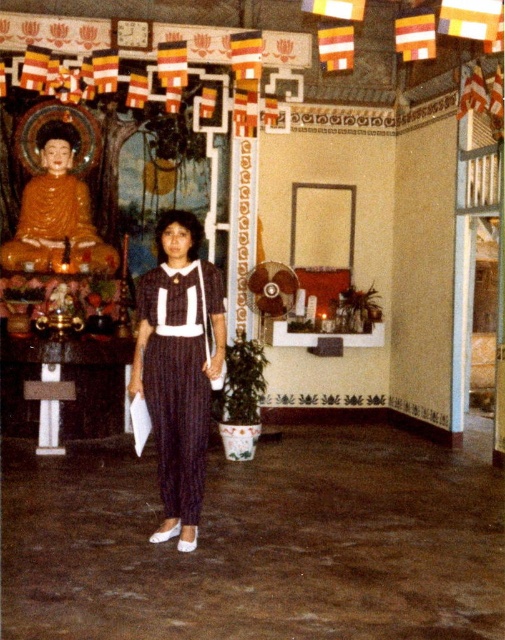
You are a photographer trying to capture a balanced composition. You have to position the striped fabric dress at center and the shiny gold statue at left in your frame. Based on their sizes, which object should you place closer to the camera to maintain balance?

The striped fabric dress at center is smaller than the shiny gold statue at left. To balance the composition, you should place the striped fabric dress at center closer to the camera so its apparent size matches the statue.

You are standing in front of the Buddha statue and notice two points marked in the scene. Which point, point (169,449) or point (45,268), is closer to you?

Point (169,449) is closer to the viewer than point (45,268).